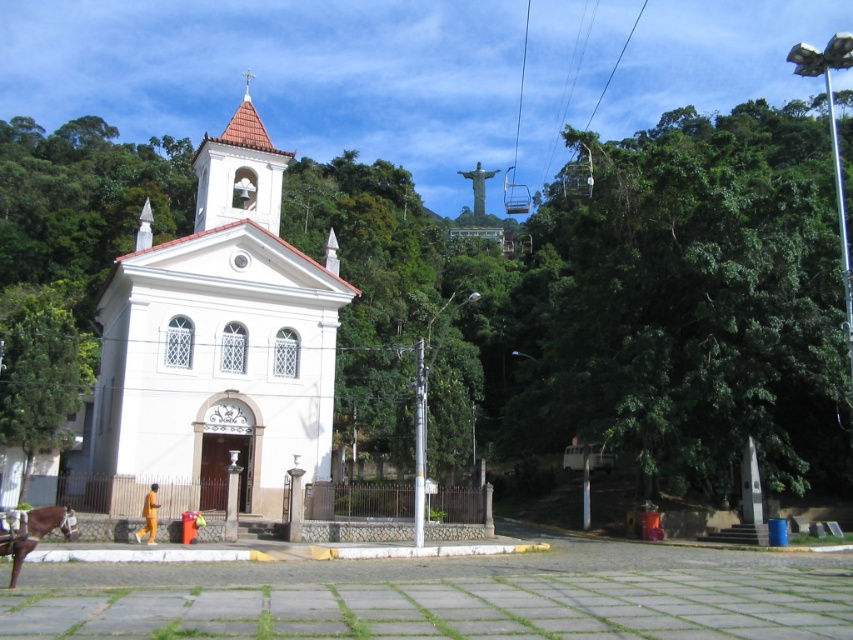
Question: Is white matte church at center wider than brown glossy horse at lower left?

Choices:
 (A) no
 (B) yes

Answer: (B)

Question: Among these objects, which one is farthest from the camera?

Choices:
 (A) white matte church at center
 (B) brown glossy horse at lower left

Answer: (A)

Question: In this image, where is brown glossy horse at lower left located relative to metallic wire at upper center?

Choices:
 (A) below
 (B) above

Answer: (A)

Question: Which is farther from the metallic wire at upper center?

Choices:
 (A) brown glossy horse at lower left
 (B) white matte church at center
 (C) green leafy tree at upper right

Answer: (A)

Question: Can you confirm if brown glossy horse at lower left is positioned below metallic wire at upper center?

Choices:
 (A) yes
 (B) no

Answer: (A)

Question: Estimate the real-world distances between objects in this image. Which object is closer to the brown glossy horse at lower left?

Choices:
 (A) white matte church at center
 (B) green leafy tree at upper right
 (C) metallic wire at upper center

Answer: (A)